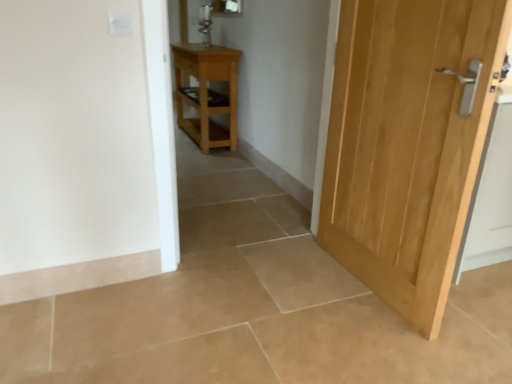
Question: Considering the positions of light brown wood nightstand at center and natural wood door at right in the image, is light brown wood nightstand at center taller or shorter than natural wood door at right?

Choices:
 (A) tall
 (B) short

Answer: (B)

Question: From the image's perspective, is light brown wood nightstand at center positioned above or below natural wood door at right?

Choices:
 (A) below
 (B) above

Answer: (B)

Question: Is point (224, 49) closer or farther from the camera than point (423, 74)?

Choices:
 (A) closer
 (B) farther

Answer: (B)

Question: Considering the positions of natural wood door at right and light brown wood nightstand at center in the image, is natural wood door at right wider or thinner than light brown wood nightstand at center?

Choices:
 (A) thin
 (B) wide

Answer: (A)

Question: Visually, is natural wood door at right positioned to the left or to the right of light brown wood nightstand at center?

Choices:
 (A) right
 (B) left

Answer: (A)

Question: In the image, is natural wood door at right positioned in front of or behind light brown wood nightstand at center?

Choices:
 (A) behind
 (B) front

Answer: (B)

Question: Is point (345, 221) positioned closer to the camera than point (214, 135)?

Choices:
 (A) closer
 (B) farther

Answer: (A)